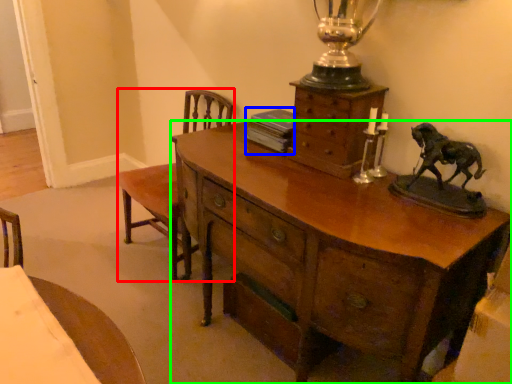
Question: Which object is positioned farthest from armchair (highlighted by a red box)? Select from book (highlighted by a blue box) and desk (highlighted by a green box).

Choices:
 (A) book
 (B) desk

Answer: (B)